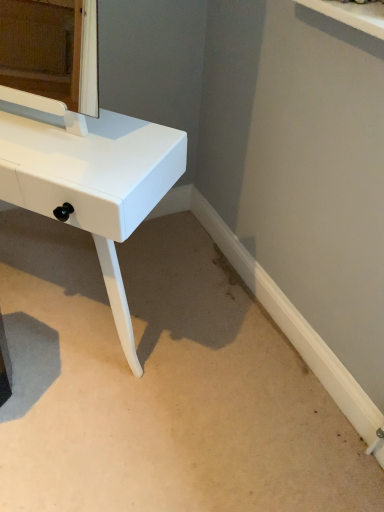
Identify the location of white glossy desk at upper left. The image size is (384, 512). (x=88, y=177).

The image size is (384, 512). Describe the element at coordinates (88, 177) in the screenshot. I see `white glossy desk at upper left` at that location.

Where is `white glossy desk at upper left`? This screenshot has width=384, height=512. white glossy desk at upper left is located at coordinates (88, 177).